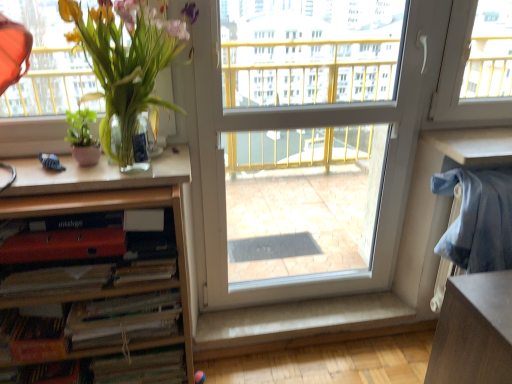
Question: Is white plastic screen door at center behind green matte plant at left, marked as the first houseplant in a left-to-right arrangement?

Choices:
 (A) yes
 (B) no

Answer: (A)

Question: Does white plastic screen door at center have a lesser height compared to green matte plant at left, the second houseplant viewed from the right?

Choices:
 (A) yes
 (B) no

Answer: (B)

Question: Is the depth of white plastic screen door at center less than that of green matte plant at left, the second houseplant viewed from the right?

Choices:
 (A) no
 (B) yes

Answer: (A)

Question: From the image's perspective, is white plastic screen door at center over green matte plant at left, marked as the first houseplant in a left-to-right arrangement?

Choices:
 (A) yes
 (B) no

Answer: (B)

Question: Does white plastic screen door at center have a smaller size compared to green matte plant at left, marked as the first houseplant in a left-to-right arrangement?

Choices:
 (A) yes
 (B) no

Answer: (B)

Question: Can you confirm if white plastic screen door at center is wider than green matte plant at left, the second houseplant viewed from the right?

Choices:
 (A) yes
 (B) no

Answer: (A)

Question: Could you tell me if wooden bookshelf at left is facing matte red book at lower left?

Choices:
 (A) no
 (B) yes

Answer: (B)

Question: From the image's perspective, would you say wooden bookshelf at left is positioned over matte red book at lower left?

Choices:
 (A) yes
 (B) no

Answer: (B)

Question: Is wooden bookshelf at left closer to the viewer compared to matte red book at lower left?

Choices:
 (A) no
 (B) yes

Answer: (B)

Question: Does wooden bookshelf at left have a smaller size compared to matte red book at lower left?

Choices:
 (A) no
 (B) yes

Answer: (A)

Question: Considering the relative sizes of wooden bookshelf at left and matte red book at lower left in the image provided, is wooden bookshelf at left wider than matte red book at lower left?

Choices:
 (A) yes
 (B) no

Answer: (A)

Question: Is wooden bookshelf at left thinner than matte red book at lower left?

Choices:
 (A) yes
 (B) no

Answer: (B)

Question: Considering the relative sizes of white plastic screen door at center and wooden bookshelf at left in the image provided, is white plastic screen door at center wider than wooden bookshelf at left?

Choices:
 (A) yes
 (B) no

Answer: (B)